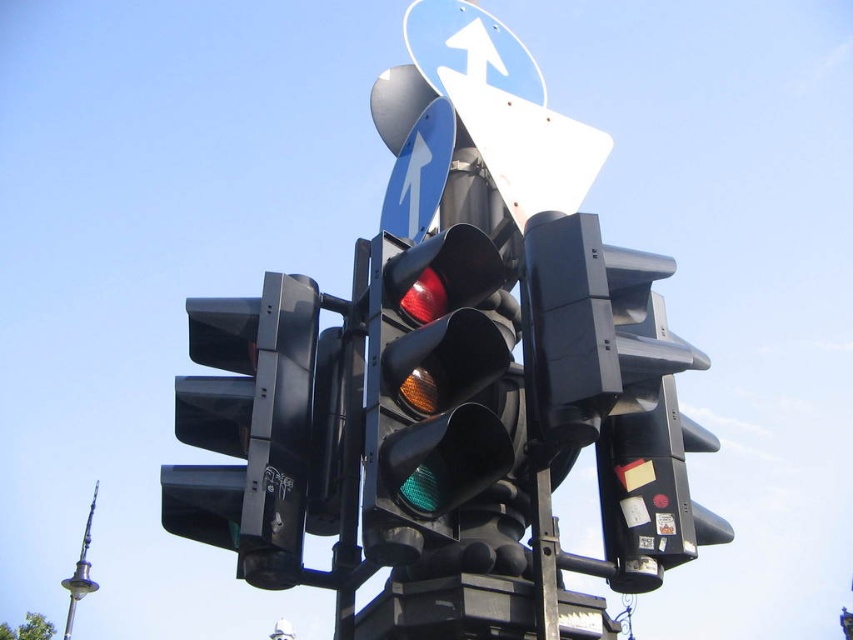
Question: Is white plastic traffic sign at upper center positioned before silver metallic pole at center?

Choices:
 (A) yes
 (B) no

Answer: (A)

Question: Can you confirm if white plastic traffic sign at upper center is positioned above silver metallic pole at center?

Choices:
 (A) no
 (B) yes

Answer: (B)

Question: Does metallic green traffic light at center have a greater width compared to black plastic traffic light at center?

Choices:
 (A) yes
 (B) no

Answer: (B)

Question: Which object is the farthest from the blue glossy sign at upper center?

Choices:
 (A) silver metallic pole at center
 (B) metallic green traffic light at center

Answer: (A)

Question: Which point is closer to the camera taking this photo?

Choices:
 (A) (442, 100)
 (B) (370, 451)

Answer: (B)

Question: Which object appears closest to the camera in this image?

Choices:
 (A) metallic green traffic light at center
 (B) white plastic traffic sign at upper center

Answer: (A)